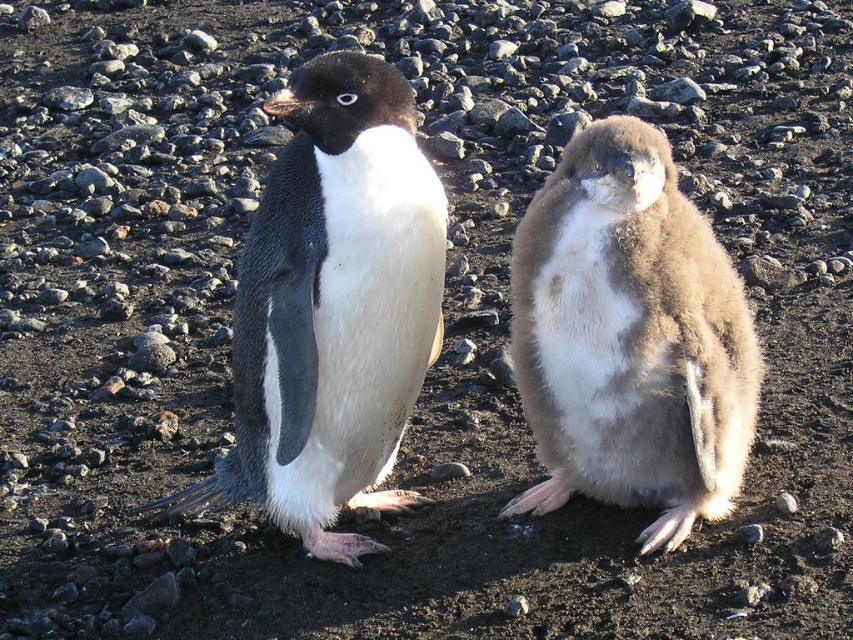
Based on the photo, you are a photographer trying to capture both the matte black penguin at left and the brown fluffy penguin at right in a single shot. Based on their positions, which penguin will appear larger in the photo?

The matte black penguin at left will appear larger in the photo because it is closer to the viewer than the brown fluffy penguin at right.

You are standing in front of the two penguins and want to place a small treat between them. The treat must be placed exactly halfway between the point at coordinates point (268, 250) and point (703, 280). Will the treat be closer to the adult penguin or the juvenile penguin?

The treat placed halfway between point (268, 250) and point (703, 280) will be closer to the juvenile penguin because point (268, 250) is closer to the viewer than point (703, 280), meaning the halfway point is nearer to the juvenile penguin which is on the right side.

You are a birdwatcher observing two penguins in their habitat. You notice the matte black penguin at left and the brown fluffy penguin at right. Which penguin is taller?

The matte black penguin at left is much taller than the brown fluffy penguin at right.